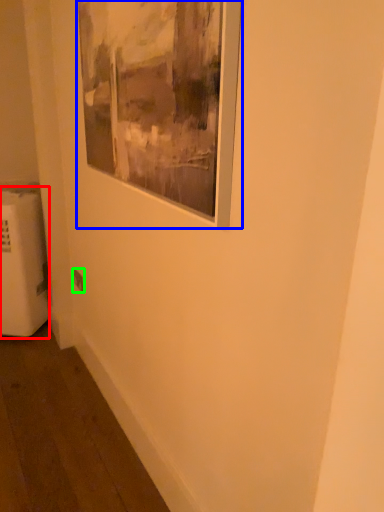
Question: Based on their relative distances, which object is nearer to radiator (highlighted by a red box)? Choose from picture frame (highlighted by a blue box) and electric outlet (highlighted by a green box).

Choices:
 (A) picture frame
 (B) electric outlet

Answer: (B)